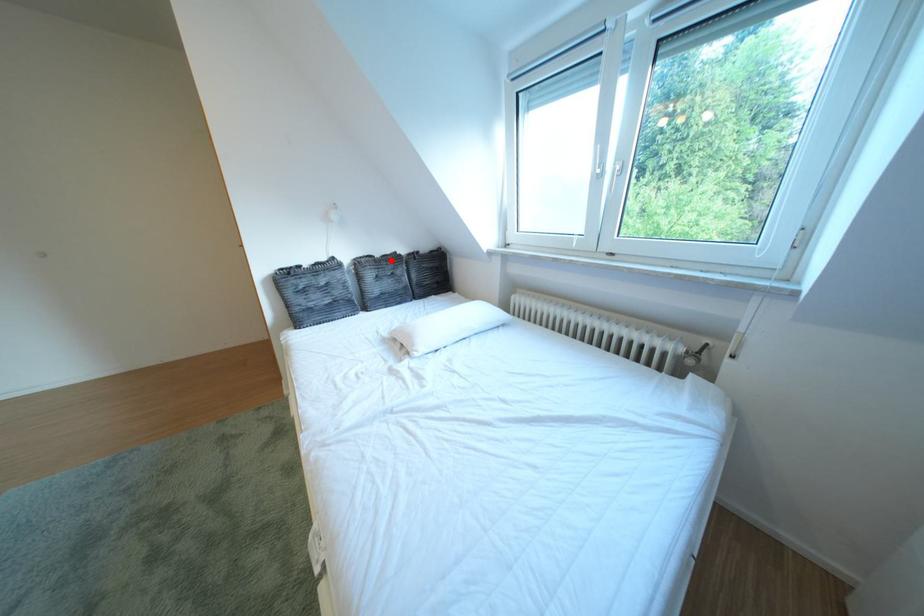
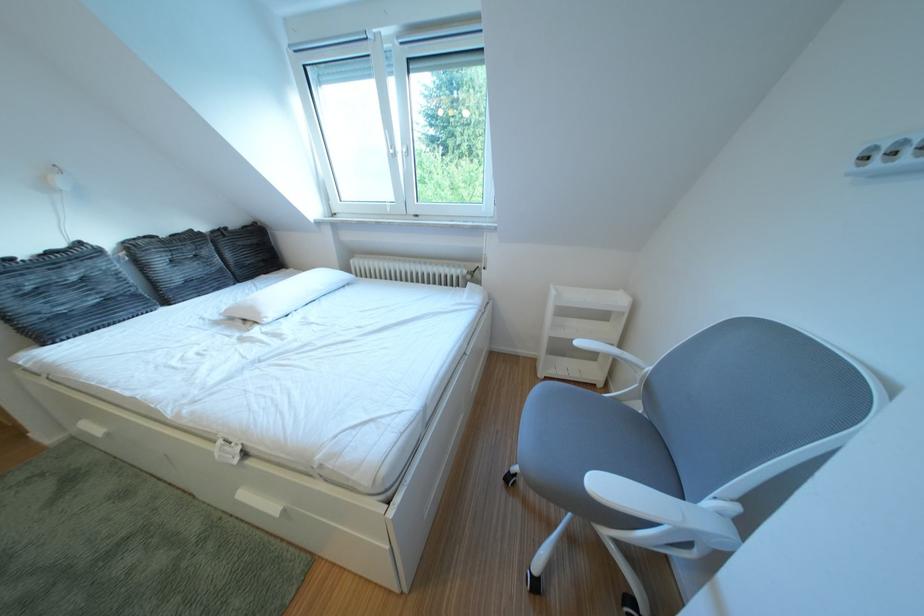
Locate, in the second image, the point that corresponds to the highlighted location in the first image.

(176, 240)